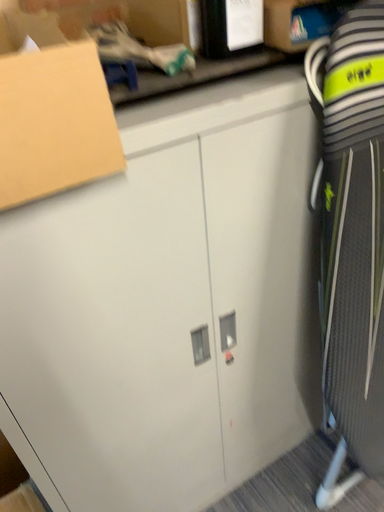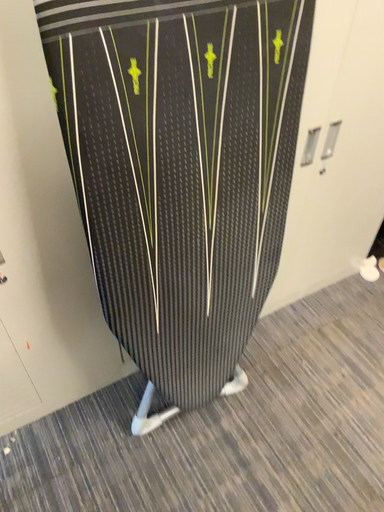
Question: How did the camera likely rotate when shooting the video?

Choices:
 (A) rotated downward
 (B) rotated upward

Answer: (A)